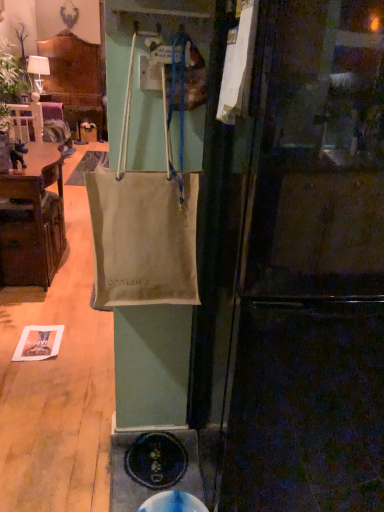
Question: Can you confirm if matte black refrigerator at center is positioned to the right of brown wood cabinet at left?

Choices:
 (A) yes
 (B) no

Answer: (A)

Question: Is matte black refrigerator at center bigger than brown wood cabinet at left?

Choices:
 (A) yes
 (B) no

Answer: (A)

Question: Is the position of matte black refrigerator at center less distant than that of brown wood cabinet at left?

Choices:
 (A) yes
 (B) no

Answer: (A)

Question: Does matte black refrigerator at center touch brown wood cabinet at left?

Choices:
 (A) yes
 (B) no

Answer: (B)

Question: From a real-world perspective, is matte black refrigerator at center on top of brown wood cabinet at left?

Choices:
 (A) no
 (B) yes

Answer: (B)

Question: In the image, is blue rubber manhole cover at lower center positioned in front of or behind matte black refrigerator at center?

Choices:
 (A) front
 (B) behind

Answer: (B)

Question: Is point 165,507 closer or farther from the camera than point 339,46?

Choices:
 (A) closer
 (B) farther

Answer: (B)

Question: In terms of size, does blue rubber manhole cover at lower center appear bigger or smaller than matte black refrigerator at center?

Choices:
 (A) small
 (B) big

Answer: (A)

Question: Visually, is blue rubber manhole cover at lower center positioned to the left or to the right of matte black refrigerator at center?

Choices:
 (A) right
 (B) left

Answer: (B)

Question: Is beige canvas bag at center inside or outside of matte black refrigerator at center?

Choices:
 (A) inside
 (B) outside

Answer: (B)

Question: Looking at the image, does beige canvas bag at center seem bigger or smaller compared to matte black refrigerator at center?

Choices:
 (A) big
 (B) small

Answer: (B)

Question: From the image's perspective, is beige canvas bag at center above or below matte black refrigerator at center?

Choices:
 (A) below
 (B) above

Answer: (B)

Question: Would you say beige canvas bag at center is to the left or to the right of matte black refrigerator at center in the picture?

Choices:
 (A) left
 (B) right

Answer: (A)

Question: From the image's perspective, is matte black refrigerator at center positioned above or below brown wood cabinet at left?

Choices:
 (A) below
 (B) above

Answer: (A)

Question: From a real-world perspective, relative to brown wood cabinet at left, is matte black refrigerator at center vertically above or below?

Choices:
 (A) above
 (B) below

Answer: (A)